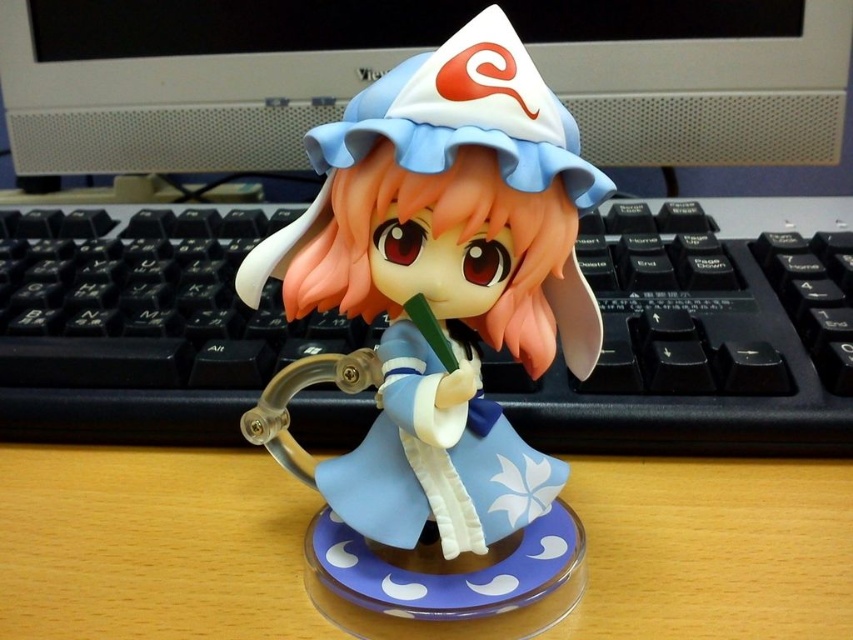
You are taking a photo of the figurine and notice two points marked on the image. The first point is at coordinate point (521, 275) and the second is at point (135, 589). Which point will appear larger in the photo?

Point (521, 275) is closer to the camera than point (135, 589), so it will appear larger in the photo.

Based on the photo, you are organizing a display and need to place the matte plastic figurine at center and the wooden table at center. Which object takes up more space in the display?

The matte plastic figurine at center is bigger than the wooden table at center, so it takes up more space in the display.